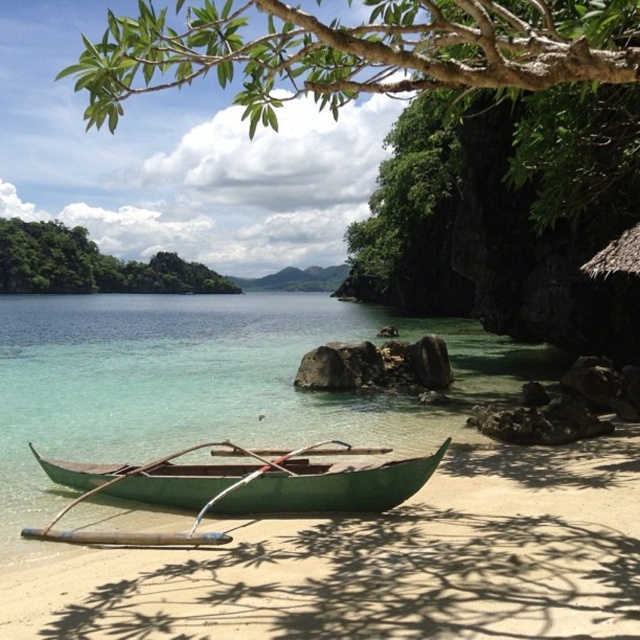
Does green sand at lower center have a smaller size compared to green polished wood canoe at center?

Correct, green sand at lower center occupies less space than green polished wood canoe at center.

Who is shorter, green sand at lower center or green polished wood canoe at center?

With less height is green sand at lower center.

The image size is (640, 640). What do you see at coordinates (380, 563) in the screenshot? I see `green sand at lower center` at bounding box center [380, 563].

What are the coordinates of `green sand at lower center` in the screenshot? It's located at (380, 563).

Which of these two, clear glass water at center or green polished wood canoe at center, stands shorter?

green polished wood canoe at center is shorter.

Image resolution: width=640 pixels, height=640 pixels. I want to click on clear glass water at center, so click(x=208, y=384).

Between point (545, 497) and point (120, 305), which one is positioned behind?

The point (120, 305) is behind.

Is green sand at lower center positioned in front of clear glass water at center?

Yes.

Who is more distant from viewer, (538,600) or (84,518)?

Positioned behind is point (84,518).

Where is `green sand at lower center`? This screenshot has width=640, height=640. green sand at lower center is located at coordinates (380, 563).